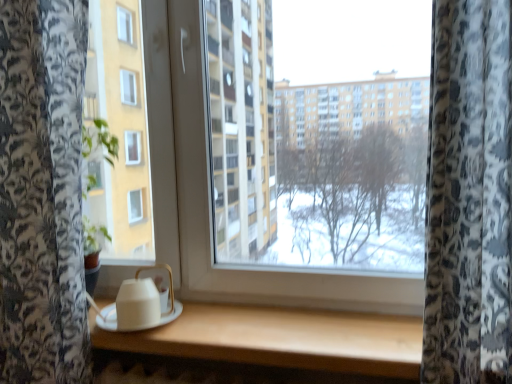
Question: Visually, is white matte table at center positioned to the left or to the right of white matte teapot at lower left?

Choices:
 (A) left
 (B) right

Answer: (B)

Question: Considering their positions, is white matte table at center located in front of or behind white matte teapot at lower left?

Choices:
 (A) behind
 (B) front

Answer: (B)

Question: In terms of height, does white matte table at center look taller or shorter compared to white matte teapot at lower left?

Choices:
 (A) short
 (B) tall

Answer: (A)

Question: Looking at their shapes, would you say white matte teapot at lower left is wider or thinner than white matte table at center?

Choices:
 (A) thin
 (B) wide

Answer: (A)

Question: Is white matte teapot at lower left in front of or behind white matte table at center in the image?

Choices:
 (A) front
 (B) behind

Answer: (B)

Question: From a real-world perspective, is white matte teapot at lower left above or below white matte table at center?

Choices:
 (A) above
 (B) below

Answer: (A)

Question: From the image's perspective, relative to white matte table at center, is white matte teapot at lower left above or below?

Choices:
 (A) above
 (B) below

Answer: (A)